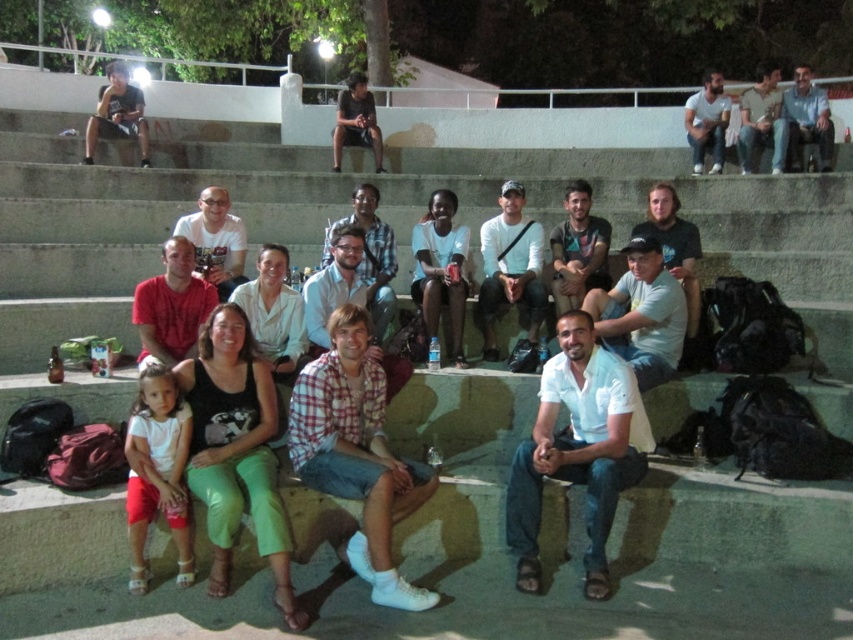
You are standing at the bottom of the steps where the group is sitting. You want to hand a snack to the person wearing the matte white shirt at center and the light blue jeans at upper right. Which person will you need to reach over first?

The matte white shirt at center is closer to the viewer than the light blue jeans at upper right, so you will need to reach over the person wearing the matte white shirt at center first.